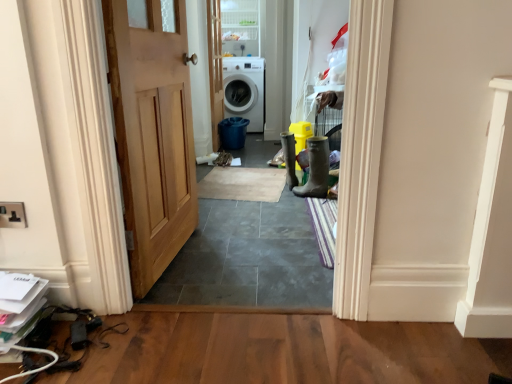
Question: Can you confirm if white glossy washing machine at center is wider than natural wood door at center, positioned as the second door in back-to-front order?

Choices:
 (A) yes
 (B) no

Answer: (A)

Question: Does white glossy washing machine at center turn towards natural wood door at center, positioned as the second door in back-to-front order?

Choices:
 (A) no
 (B) yes

Answer: (B)

Question: From the image's perspective, is white glossy washing machine at center above natural wood door at center, positioned as the second door in back-to-front order?

Choices:
 (A) yes
 (B) no

Answer: (A)

Question: Does white glossy washing machine at center come in front of natural wood door at center, acting as the first door starting from the front?

Choices:
 (A) yes
 (B) no

Answer: (B)

Question: Is white glossy washing machine at center taller than natural wood door at center, positioned as the second door in back-to-front order?

Choices:
 (A) yes
 (B) no

Answer: (B)

Question: Looking at the image, does white glossy washing machine at center seem bigger or smaller compared to clear glass door at upper center?

Choices:
 (A) big
 (B) small

Answer: (A)

Question: Considering their positions, is white glossy washing machine at center located in front of or behind clear glass door at upper center?

Choices:
 (A) front
 (B) behind

Answer: (B)

Question: From the image's perspective, is white glossy washing machine at center located above or below clear glass door at upper center?

Choices:
 (A) above
 (B) below

Answer: (B)

Question: Does point (264, 89) appear closer or farther from the camera than point (247, 34)?

Choices:
 (A) closer
 (B) farther

Answer: (B)

Question: Would you say clear glass door at upper center is inside or outside white glossy door at center, placed as the 1th door when sorted from back to front?

Choices:
 (A) inside
 (B) outside

Answer: (B)

Question: Is clear glass door at upper center in front of or behind white glossy door at center, the second door positioned from the front, in the image?

Choices:
 (A) behind
 (B) front

Answer: (A)

Question: Considering the relative positions of clear glass door at upper center and white glossy door at center, the second door positioned from the front, in the image provided, is clear glass door at upper center to the left or to the right of white glossy door at center, the second door positioned from the front,?

Choices:
 (A) left
 (B) right

Answer: (B)

Question: Does point (246, 3) appear closer or farther from the camera than point (211, 26)?

Choices:
 (A) farther
 (B) closer

Answer: (A)

Question: Considering the positions of natural wood door at center, acting as the first door starting from the front, and clear glass door at upper center in the image, is natural wood door at center, acting as the first door starting from the front, taller or shorter than clear glass door at upper center?

Choices:
 (A) short
 (B) tall

Answer: (B)

Question: From the image's perspective, is natural wood door at center, acting as the first door starting from the front, above or below clear glass door at upper center?

Choices:
 (A) below
 (B) above

Answer: (A)